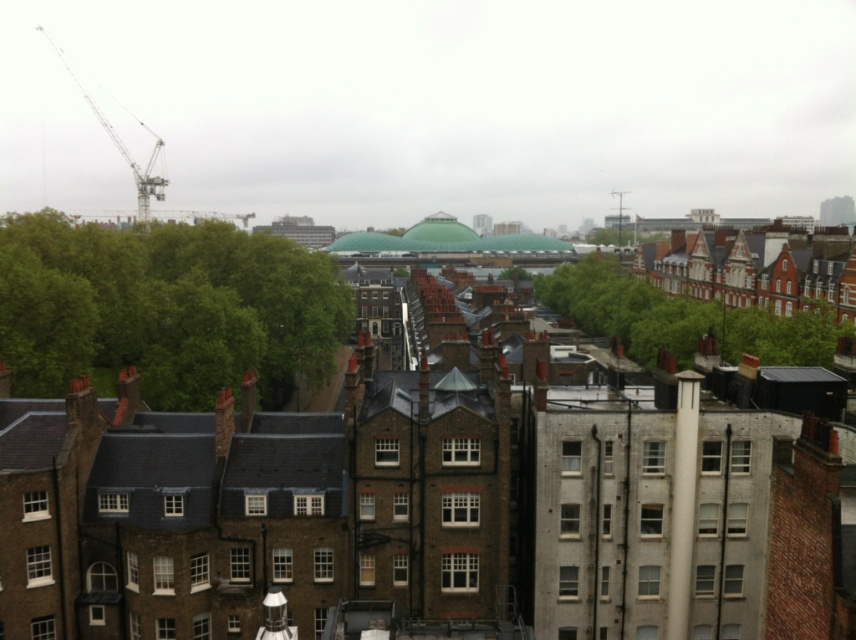
You are an architect designing a new park in the city. You see the green leafy tree at center and the metallic silver crane at upper left in the image. Which object would require more space for its placement due to size differences?

The metallic silver crane at upper left requires more space for placement since it is larger than the green leafy tree at center.

You are standing at the viewpoint of the image and want to know how far the point at coordinates [206,339] is from you. Can you determine the distance?

The point at coordinates [206,339] is 99.28 meters away from the viewer.

You are an architect designing a new building and want to ensure it aligns with the existing structures in the scene. Based on the image, which object is closer to the center of the urban landscape, the green leafy tree at left or the metallic silver crane at upper left?

The green leafy tree at left is positioned on the right side of the metallic silver crane at upper left, so the metallic silver crane at upper left is closer to the center of the urban landscape.